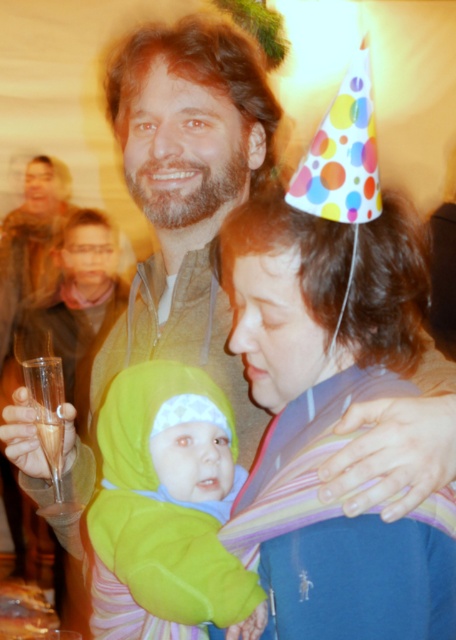
Question: Is matte purple scarf at center thinner than soft fleece baby at center?

Choices:
 (A) no
 (B) yes

Answer: (A)

Question: Which point appears closest to the camera in this image?

Choices:
 (A) (424, 291)
 (B) (200, 609)

Answer: (B)

Question: Can you confirm if matte purple scarf at center is thinner than soft fleece baby at center?

Choices:
 (A) yes
 (B) no

Answer: (B)

Question: Which of the following is the farthest from the observer?

Choices:
 (A) (345, 368)
 (B) (222, 608)

Answer: (A)

Question: Does matte purple scarf at center appear on the right side of soft fleece baby at center?

Choices:
 (A) yes
 (B) no

Answer: (A)